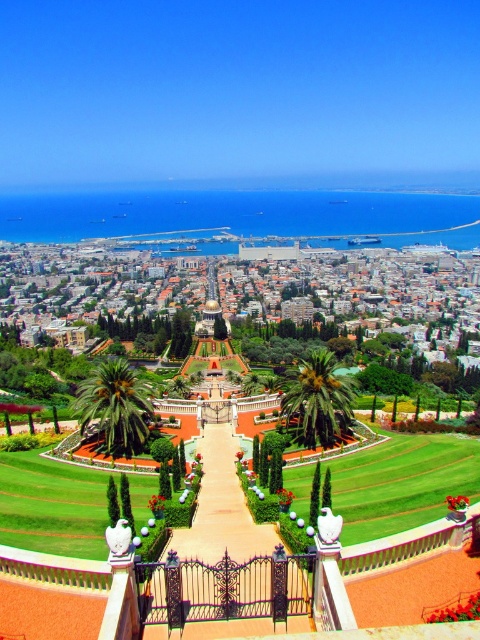
Where is `green leafy palm tree at center`? green leafy palm tree at center is located at coordinates (115, 406).

Does point (83, 385) lie in front of point (332, 390)?

No, it is not.

Where is `green leafy palm tree at center`? green leafy palm tree at center is located at coordinates (115, 406).

Is metallic gate at center above green leafy palm at center?

Actually, metallic gate at center is below green leafy palm at center.

What do you see at coordinates (220, 508) in the screenshot? Image resolution: width=480 pixels, height=640 pixels. I see `metallic gate at center` at bounding box center [220, 508].

Describe the element at coordinates (220, 508) in the screenshot. The height and width of the screenshot is (640, 480). I see `metallic gate at center` at that location.

Find the location of a particular element. The width and height of the screenshot is (480, 640). metallic gate at center is located at coordinates (220, 508).

Is metallic gate at center above green leafy palm tree at center?

No, metallic gate at center is not above green leafy palm tree at center.

Which is below, metallic gate at center or green leafy palm tree at center?

metallic gate at center

Locate an element on the screen. The height and width of the screenshot is (640, 480). metallic gate at center is located at coordinates (220, 508).